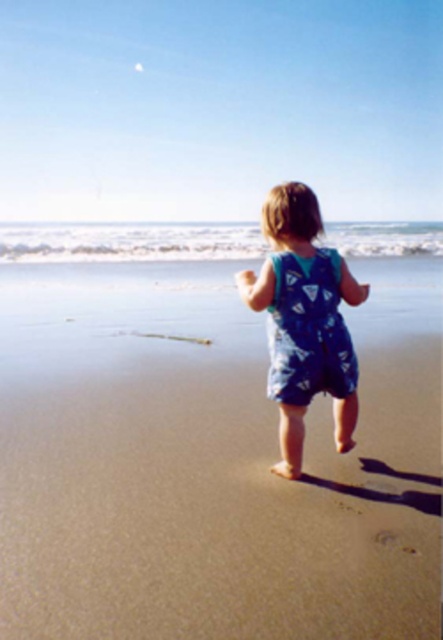
Question: Which object appears farthest from the camera in this image?

Choices:
 (A) blue fabric baby at center
 (B) blue cotton onesie at center

Answer: (B)

Question: Is blue fabric baby at center closer to camera compared to blue cotton onesie at center?

Choices:
 (A) no
 (B) yes

Answer: (B)

Question: Among these objects, which one is farthest from the camera?

Choices:
 (A) blue cotton onesie at center
 (B) blue fabric baby at center

Answer: (A)

Question: Considering the relative positions of blue fabric baby at center and blue cotton onesie at center in the image provided, where is blue fabric baby at center located with respect to blue cotton onesie at center?

Choices:
 (A) left
 (B) right

Answer: (A)

Question: Does blue fabric baby at center have a greater width compared to blue cotton onesie at center?

Choices:
 (A) no
 (B) yes

Answer: (B)